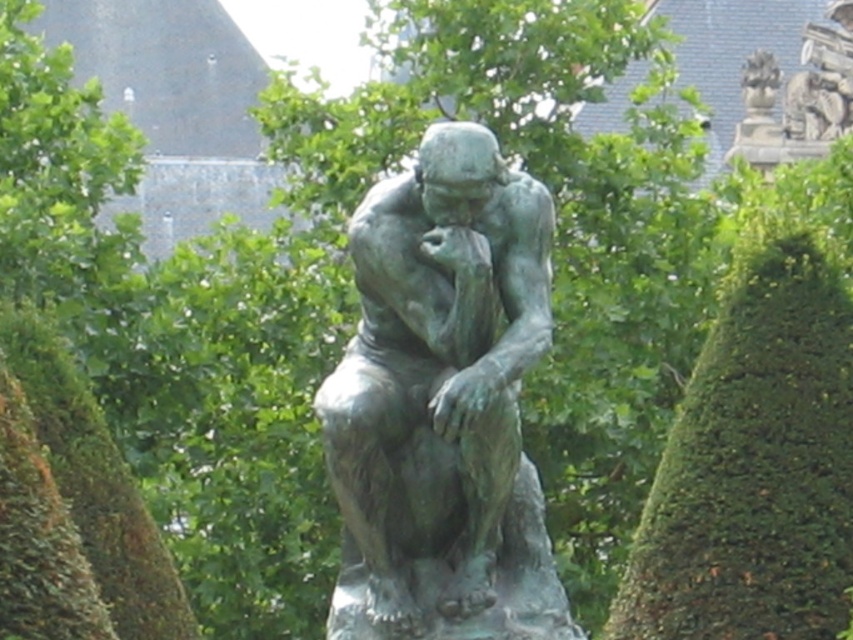
You are an art student who wants to sketch the bronze statue at center and the bronze statue at upper right. Which one should you choose if you want to draw a larger subject?

The bronze statue at center is bigger than the bronze statue at upper right, so you should choose the bronze statue at center to draw a larger subject.

You are standing in front of the sculpture garden and want to locate the bronze statue at center. According to the coordinates provided, where exactly is it positioned?

The bronze statue at center is positioned at the 2D coordinates point of (444, 403).

You are standing in a garden with two bronze statues. You see the bronze statue at center and the bronze statue at upper right. Which statue is positioned more to the left side of the garden?

The bronze statue at center is positioned more to the left side of the garden than the bronze statue at upper right.